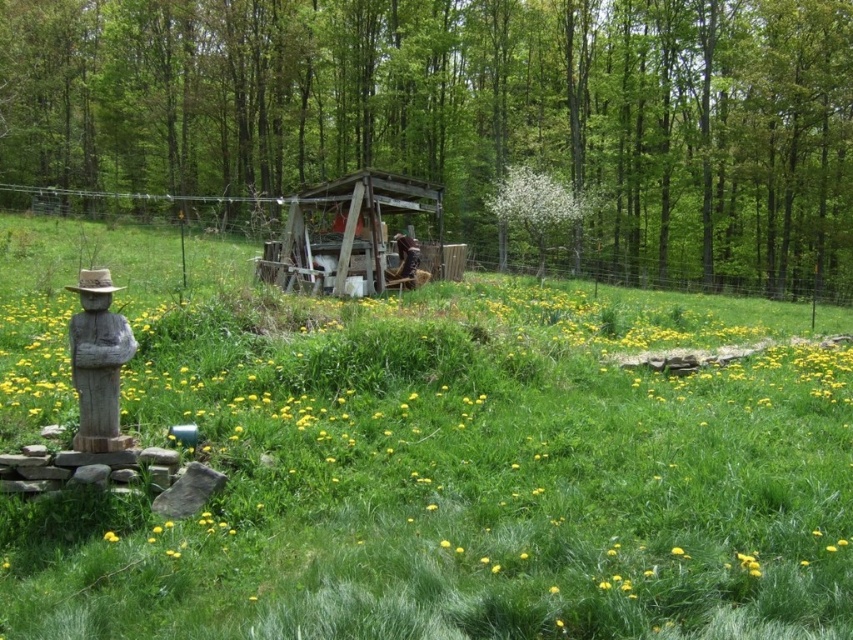
Is green grass at center shorter than wooden statue at left?

No.

Is green grass at center to the left of wooden statue at left from the viewer's perspective?

No, green grass at center is not to the left of wooden statue at left.

Does point (138, 316) come in front of point (99, 314)?

No, (138, 316) is behind (99, 314).

At what (x,y) coordinates should I click in order to perform the action: click on green grass at center. Please return your answer as a coordinate pair (x, y). The image size is (853, 640). Looking at the image, I should click on click(x=428, y=460).

Who is positioned more to the right, straw hat at left or yellow matte flower at center?

From the viewer's perspective, yellow matte flower at center appears more on the right side.

Is straw hat at left further to the viewer compared to yellow matte flower at center?

Yes, it is behind yellow matte flower at center.

Does point (83, 269) lie in front of point (109, 531)?

No, it is not.

Find the location of a particular element. This screenshot has height=640, width=853. straw hat at left is located at coordinates (93, 282).

Is wooden statue at left in front of straw hat at left?

Yes, it is.

Is point (99, 275) positioned in front of point (82, 284)?

That is False.

Is point (91, 337) in front of point (85, 288)?

That is False.

Locate an element on the screen. The image size is (853, 640). wooden statue at left is located at coordinates (97, 362).